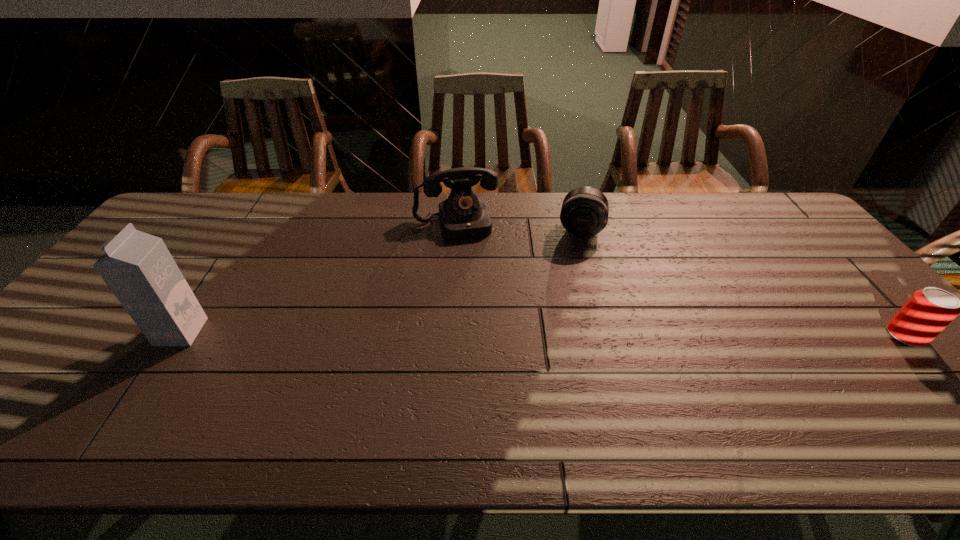
The height and width of the screenshot is (540, 960). In order to click on free space located on the front-facing side of the third object from left to right in this screenshot , I will do `click(568, 310)`.

Locate an element on the screen. vacant point located on the front-facing side of the third object from left to right is located at coordinates (564, 335).

Image resolution: width=960 pixels, height=540 pixels. In order to click on blank space located 0.110m on the dial of the third object from right to left in this screenshot , I will do `click(469, 262)`.

The image size is (960, 540). What are the coordinates of `blank area located on the dial of the third object from right to left` in the screenshot? It's located at (471, 269).

Where is `vacant point located 0.270m on the dial of the third object from right to left`? vacant point located 0.270m on the dial of the third object from right to left is located at coordinates (480, 299).

Where is `telephoto lens located at the far edge`? telephoto lens located at the far edge is located at coordinates (584, 213).

You are a GUI agent. You are given a task and a screenshot of the screen. Output one action in this format:
    pyautogui.click(x=<x>, y=<y>)
    Task: Click on the telephone located in the far edge section of the desktop
    This screenshot has width=960, height=540.
    Given the screenshot: What is the action you would take?
    pyautogui.click(x=463, y=215)

Locate an element on the screen. object located at the right edge is located at coordinates (929, 311).

You are a GUI agent. You are given a task and a screenshot of the screen. Output one action in this format:
    pyautogui.click(x=<x>, y=<y>)
    Task: Click on the vacant space at the far edge
    The width and height of the screenshot is (960, 540).
    Given the screenshot: What is the action you would take?
    pyautogui.click(x=322, y=221)

Locate an element on the screen. The width and height of the screenshot is (960, 540). vacant space at the near edge is located at coordinates (361, 394).